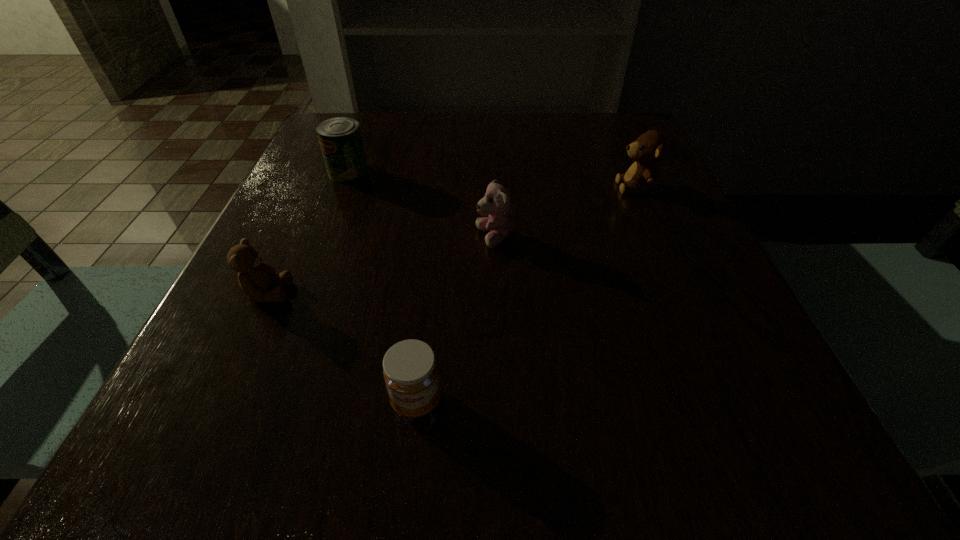
Identify the location of blank space located on the face of the farthest teddy bear. The width and height of the screenshot is (960, 540). (420, 187).

Where is `vacant space located on the face of the farthest teddy bear`? vacant space located on the face of the farthest teddy bear is located at coordinates (494, 187).

This screenshot has width=960, height=540. In order to click on vacant space located 0.340m at the face of the second farthest teddy bear in this screenshot , I will do `click(284, 238)`.

This screenshot has height=540, width=960. I want to click on vacant position located 0.050m at the face of the second farthest teddy bear, so click(447, 238).

Identify the location of vacant space located at the face of the second farthest teddy bear. (352, 238).

The height and width of the screenshot is (540, 960). What are the coordinates of `vacant space located on the right of the can` in the screenshot? It's located at (457, 172).

Identify the location of vacant area situated on the front-facing side of the nearest teddy bear. (360, 293).

Where is `object that is at the near edge`? object that is at the near edge is located at coordinates (410, 370).

Locate an element on the screen. The height and width of the screenshot is (540, 960). can present at the left edge is located at coordinates (340, 139).

Where is `teddy bear at the left edge`? The height and width of the screenshot is (540, 960). teddy bear at the left edge is located at coordinates (256, 278).